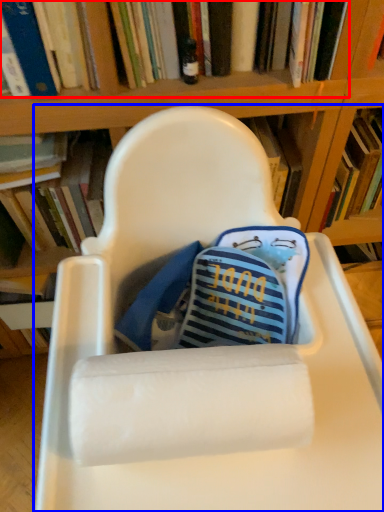
Question: Which of the following is the closest to the observer, book (highlighted by a red box) or chair (highlighted by a blue box)?

Choices:
 (A) book
 (B) chair

Answer: (B)